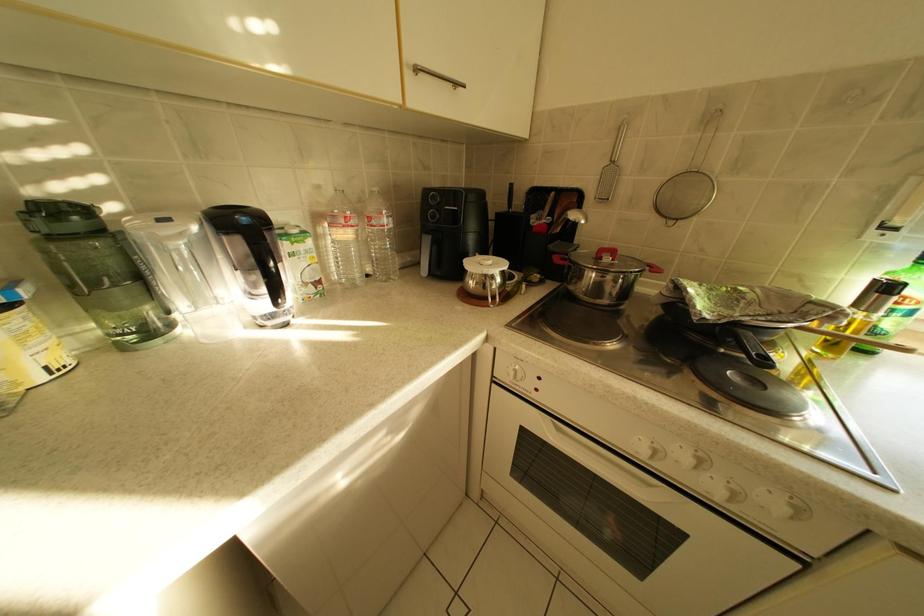
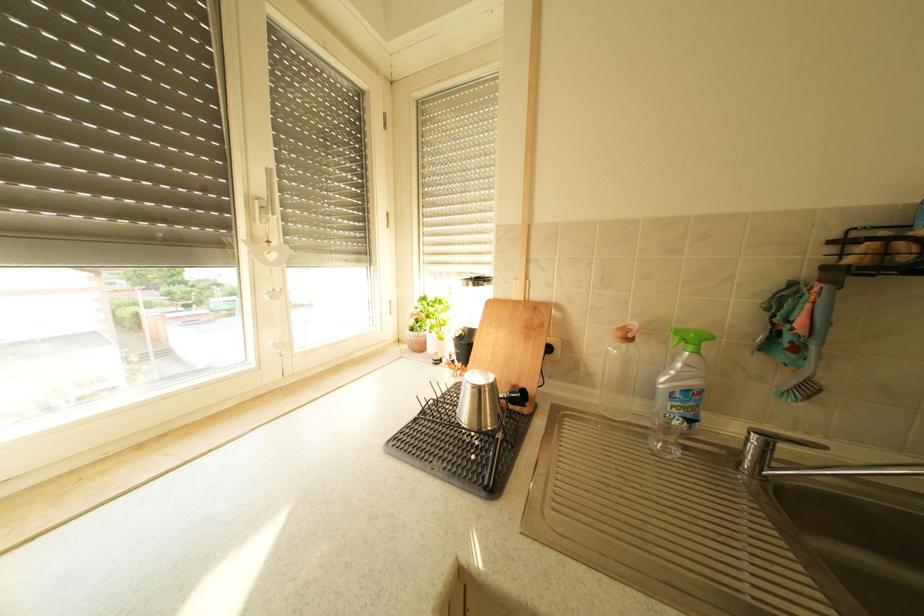
How did the camera likely rotate?

The camera rotated toward right-down.